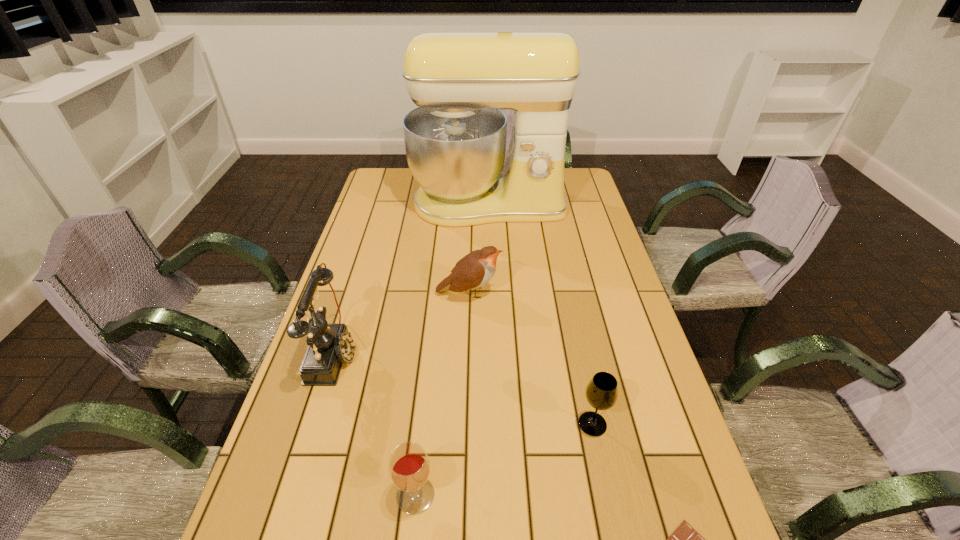
The width and height of the screenshot is (960, 540). In order to click on the farthest object in this screenshot , I will do (x=455, y=141).

Locate an element on the screen. the tallest object is located at coordinates (455, 141).

Image resolution: width=960 pixels, height=540 pixels. I want to click on the fifth shortest object, so click(329, 345).

The image size is (960, 540). Find the location of `the leftmost object`. the leftmost object is located at coordinates (329, 345).

This screenshot has width=960, height=540. Find the location of `the second farthest object`. the second farthest object is located at coordinates (476, 269).

Locate an element on the screen. The image size is (960, 540). the farther wineglass is located at coordinates (601, 393).

Find the location of a particular element. the third nearest object is located at coordinates (601, 393).

This screenshot has width=960, height=540. Identify the location of the left wineglass. [409, 467].

Find the location of `the second nearest object`. the second nearest object is located at coordinates (409, 467).

The height and width of the screenshot is (540, 960). Find the location of `free space located 0.340m on the side of the mixer with the control knob`. free space located 0.340m on the side of the mixer with the control knob is located at coordinates coord(491,296).